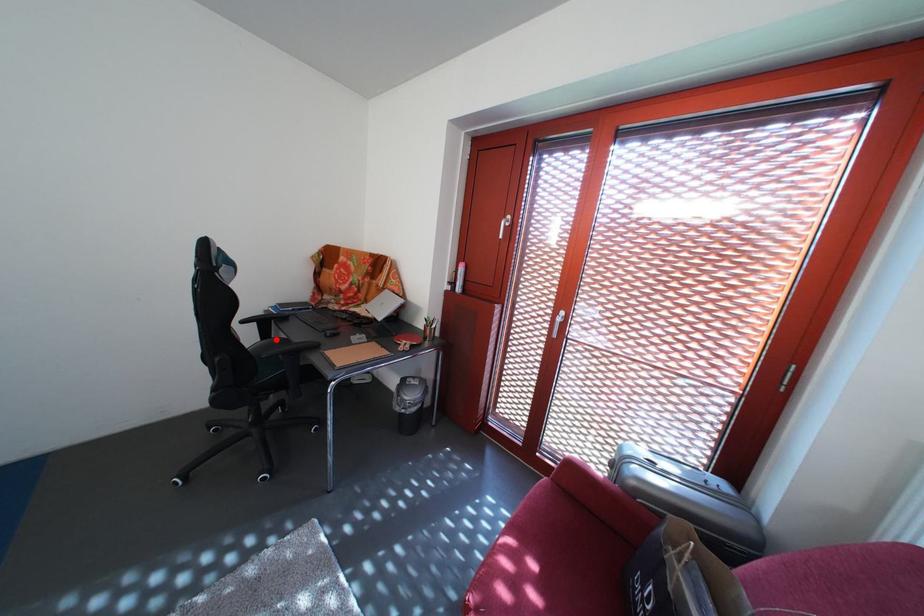
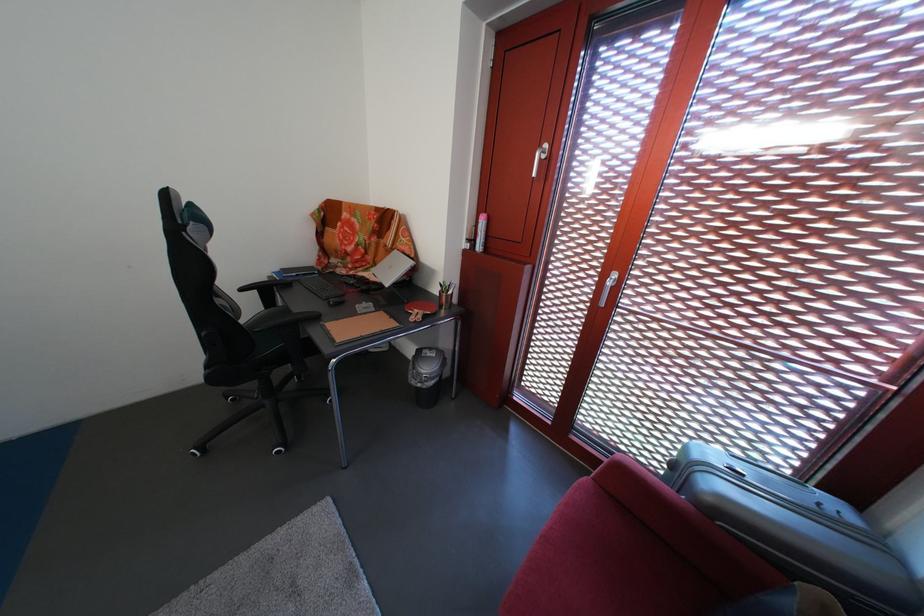
Locate, in the second image, the point that corresponds to the highlighted location in the first image.

(280, 308)